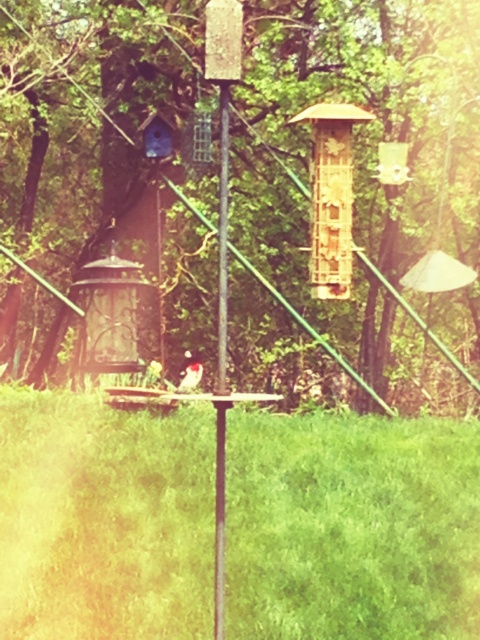
Question: Is brown wooden birdhouse at center wider than white fluffy bird at center?

Choices:
 (A) yes
 (B) no

Answer: (A)

Question: Does brown wooden birdhouse at center appear on the left side of white fluffy bird at center?

Choices:
 (A) no
 (B) yes

Answer: (A)

Question: Which point is farther to the camera?

Choices:
 (A) (96, 108)
 (B) (183, 353)
 (C) (223, 372)

Answer: (B)

Question: Estimate the real-world distances between objects in this image. Which object is farther from the smooth wood pole at center?

Choices:
 (A) brown wooden birdhouse at center
 (B) white fluffy bird at center

Answer: (A)

Question: Considering the real-world distances, which object is closest to the white fluffy bird at center?

Choices:
 (A) brown wooden birdhouse at center
 (B) smooth wood pole at center

Answer: (A)

Question: Can you confirm if smooth wood pole at center is smaller than white fluffy bird at center?

Choices:
 (A) yes
 (B) no

Answer: (B)